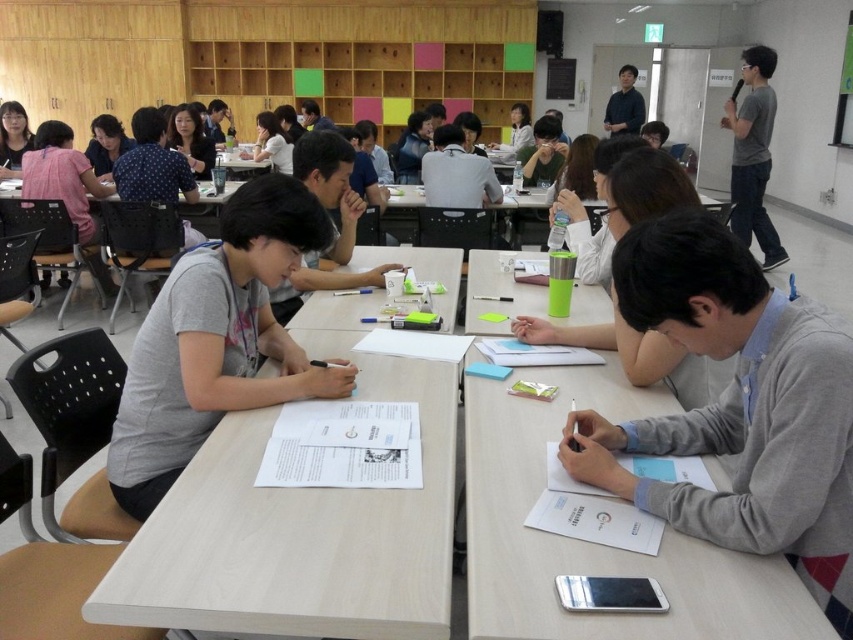
Is gray sweater at lower right to the left of pink fabric shirt at upper left from the viewer's perspective?

Incorrect, gray sweater at lower right is not on the left side of pink fabric shirt at upper left.

What do you see at coordinates (737, 406) in the screenshot?
I see `gray sweater at lower right` at bounding box center [737, 406].

This screenshot has width=853, height=640. What are the coordinates of `gray sweater at lower right` in the screenshot? It's located at (737, 406).

Who is higher up, light wood table at center or matte black hair at upper left?

matte black hair at upper left is higher up.

Does light wood table at center appear under matte black hair at upper left?

Indeed, light wood table at center is positioned under matte black hair at upper left.

Does point (241, 490) lie behind point (15, 132)?

No, (241, 490) is closer to viewer.

At what (x,y) coordinates should I click in order to perform the action: click on light wood table at center. Please return your answer as a coordinate pair (x, y). Looking at the image, I should click on [299, 531].

Does point (305, 282) lie behind point (49, 122)?

No.

Can you confirm if gray matte shirt at center is positioned below pink fabric shirt at upper left?

Yes.

Measure the distance between point (328,200) and camera.

Point (328,200) is 8.43 feet away from camera.

Where is `gray matte shirt at center`? This screenshot has width=853, height=640. gray matte shirt at center is located at coordinates (329, 218).